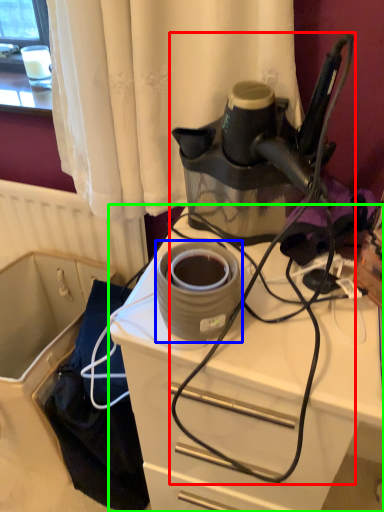
Question: Which object is positioned farthest from wire (highlighted by a red box)? Select from appliance (highlighted by a blue box) and desk (highlighted by a green box).

Choices:
 (A) appliance
 (B) desk

Answer: (A)